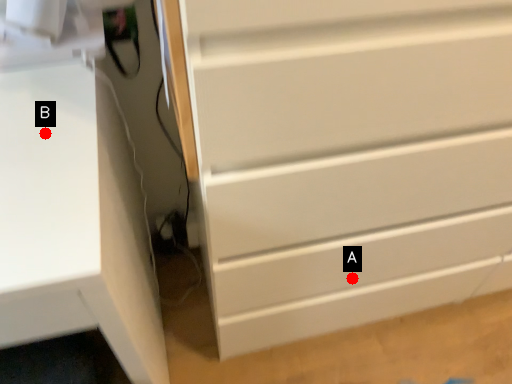
Question: Two points are circled on the image, labeled by A and B beside each circle. Which point is farther to the camera?

Choices:
 (A) A is further
 (B) B is further

Answer: (A)